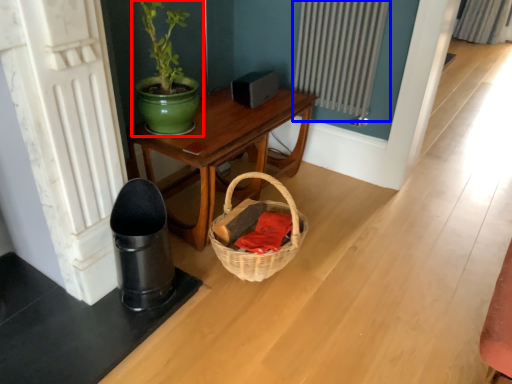
Question: Which object is closer to the camera taking this photo, houseplant (highlighted by a red box) or radiator (highlighted by a blue box)?

Choices:
 (A) houseplant
 (B) radiator

Answer: (A)